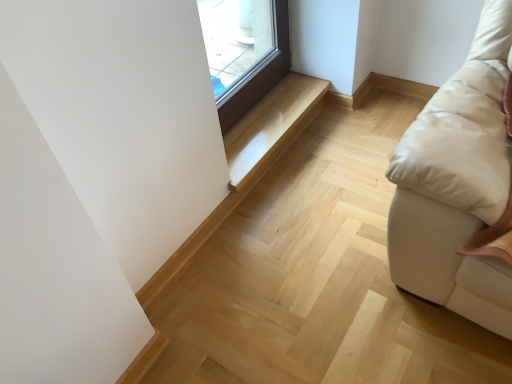
What is the approximate height of light wood stairwell at center, placed as the second stairwell when sorted from top to bottom?

9.00 centimeters.

In order to click on light wood stairwell at center, marked as the first stairwell in a bottom-to-top arrangement in this screenshot , I will do `click(249, 160)`.

Measure the distance between light wood stairwell at center, marked as the first stairwell in a bottom-to-top arrangement, and camera.

light wood stairwell at center, marked as the first stairwell in a bottom-to-top arrangement, is 5.05 feet from camera.

The width and height of the screenshot is (512, 384). What do you see at coordinates (249, 160) in the screenshot? I see `light wood stairwell at center, marked as the first stairwell in a bottom-to-top arrangement` at bounding box center [249, 160].

What do you see at coordinates (269, 125) in the screenshot? I see `glossy wood bench at center, arranged as the 1th stairwell when viewed from the top` at bounding box center [269, 125].

Identify the location of glossy wood bench at center, arranged as the 1th stairwell when viewed from the top. Image resolution: width=512 pixels, height=384 pixels. (269, 125).

How much space does glossy wood bench at center, which appears as the second stairwell when ordered from the bottom, occupy horizontally?

The width of glossy wood bench at center, which appears as the second stairwell when ordered from the bottom, is 12.02 inches.

Locate an element on the screen. light wood stairwell at center, marked as the first stairwell in a bottom-to-top arrangement is located at coordinates (249, 160).

Which object is positioned more to the left, light wood stairwell at center, marked as the first stairwell in a bottom-to-top arrangement, or glossy wood bench at center, which appears as the second stairwell when ordered from the bottom?

From the viewer's perspective, light wood stairwell at center, marked as the first stairwell in a bottom-to-top arrangement, appears more on the left side.

Considering the relative positions of light wood stairwell at center, marked as the first stairwell in a bottom-to-top arrangement, and glossy wood bench at center, arranged as the 1th stairwell when viewed from the top, in the image provided, is light wood stairwell at center, marked as the first stairwell in a bottom-to-top arrangement, behind glossy wood bench at center, arranged as the 1th stairwell when viewed from the top,?

No, it is in front of glossy wood bench at center, arranged as the 1th stairwell when viewed from the top.

Which is nearer, [291,102] or [290,111]?

Positioned in front is point [290,111].

From the image's perspective, does light wood stairwell at center, marked as the first stairwell in a bottom-to-top arrangement, appear higher than glossy wood bench at center, arranged as the 1th stairwell when viewed from the top?

Actually, light wood stairwell at center, marked as the first stairwell in a bottom-to-top arrangement, appears below glossy wood bench at center, arranged as the 1th stairwell when viewed from the top, in the image.

From a real-world perspective, is light wood stairwell at center, marked as the first stairwell in a bottom-to-top arrangement, above or below glossy wood bench at center, arranged as the 1th stairwell when viewed from the top?

In terms of real-world spatial position, light wood stairwell at center, marked as the first stairwell in a bottom-to-top arrangement, is below glossy wood bench at center, arranged as the 1th stairwell when viewed from the top.

Which of these two, light wood stairwell at center, placed as the second stairwell when sorted from top to bottom, or glossy wood bench at center, which appears as the second stairwell when ordered from the bottom, is thinner?

light wood stairwell at center, placed as the second stairwell when sorted from top to bottom.

Consider the image. Who is taller, light wood stairwell at center, placed as the second stairwell when sorted from top to bottom, or glossy wood bench at center, which appears as the second stairwell when ordered from the bottom?

light wood stairwell at center, placed as the second stairwell when sorted from top to bottom.

Considering the relative sizes of light wood stairwell at center, marked as the first stairwell in a bottom-to-top arrangement, and glossy wood bench at center, arranged as the 1th stairwell when viewed from the top, in the image provided, is light wood stairwell at center, marked as the first stairwell in a bottom-to-top arrangement, smaller than glossy wood bench at center, arranged as the 1th stairwell when viewed from the top,?

Yes.

Is glossy wood bench at center, arranged as the 1th stairwell when viewed from the top, a part of light wood stairwell at center, marked as the first stairwell in a bottom-to-top arrangement?

That's incorrect, glossy wood bench at center, arranged as the 1th stairwell when viewed from the top, is not inside light wood stairwell at center, marked as the first stairwell in a bottom-to-top arrangement.

Are light wood stairwell at center, placed as the second stairwell when sorted from top to bottom, and glossy wood bench at center, which appears as the second stairwell when ordered from the bottom, beside each other?

Yes, light wood stairwell at center, placed as the second stairwell when sorted from top to bottom, is beside glossy wood bench at center, which appears as the second stairwell when ordered from the bottom.

Is light wood stairwell at center, placed as the second stairwell when sorted from top to bottom, aimed at glossy wood bench at center, arranged as the 1th stairwell when viewed from the top?

No, light wood stairwell at center, placed as the second stairwell when sorted from top to bottom, is not oriented towards glossy wood bench at center, arranged as the 1th stairwell when viewed from the top.

Can you tell me how much light wood stairwell at center, marked as the first stairwell in a bottom-to-top arrangement, and glossy wood bench at center, which appears as the second stairwell when ordered from the bottom, differ in facing direction?

There is a 0.0437-degree angle between the facing directions of light wood stairwell at center, marked as the first stairwell in a bottom-to-top arrangement, and glossy wood bench at center, which appears as the second stairwell when ordered from the bottom.

Measure the distance from light wood stairwell at center, placed as the second stairwell when sorted from top to bottom, to glossy wood bench at center, arranged as the 1th stairwell when viewed from the top.

The distance of light wood stairwell at center, placed as the second stairwell when sorted from top to bottom, from glossy wood bench at center, arranged as the 1th stairwell when viewed from the top, is 1.53 inches.

In the image, there is a glossy wood bench at center, which appears as the second stairwell when ordered from the bottom. At what (x,y) coordinates should I click in order to perform the action: click on stairwell below it (from a real-world perspective). Please return your answer as a coordinate pair (x, y). This screenshot has height=384, width=512. Looking at the image, I should click on (249, 160).

Visually, is glossy wood bench at center, which appears as the second stairwell when ordered from the bottom, positioned to the left or to the right of light wood stairwell at center, placed as the second stairwell when sorted from top to bottom?

glossy wood bench at center, which appears as the second stairwell when ordered from the bottom, is positioned on light wood stairwell at center, placed as the second stairwell when sorted from top to bottom,'s right side.

Does glossy wood bench at center, arranged as the 1th stairwell when viewed from the top, lie in front of light wood stairwell at center, marked as the first stairwell in a bottom-to-top arrangement?

No, it is not.

Is point (303, 75) positioned before point (285, 125)?

No, (303, 75) is further to viewer.

From the image's perspective, between glossy wood bench at center, arranged as the 1th stairwell when viewed from the top, and light wood stairwell at center, placed as the second stairwell when sorted from top to bottom, who is located below?

light wood stairwell at center, placed as the second stairwell when sorted from top to bottom, from the image's perspective.

Looking at this image, from a real-world perspective, which object stands above the other?

In real-world perspective, glossy wood bench at center, which appears as the second stairwell when ordered from the bottom, is above.

Can you confirm if glossy wood bench at center, which appears as the second stairwell when ordered from the bottom, is wider than light wood stairwell at center, marked as the first stairwell in a bottom-to-top arrangement?

Correct, the width of glossy wood bench at center, which appears as the second stairwell when ordered from the bottom, exceeds that of light wood stairwell at center, marked as the first stairwell in a bottom-to-top arrangement.

Who is taller, glossy wood bench at center, which appears as the second stairwell when ordered from the bottom, or light wood stairwell at center, marked as the first stairwell in a bottom-to-top arrangement?

light wood stairwell at center, marked as the first stairwell in a bottom-to-top arrangement, is taller.

Is glossy wood bench at center, arranged as the 1th stairwell when viewed from the top, bigger than light wood stairwell at center, placed as the second stairwell when sorted from top to bottom?

Yes, glossy wood bench at center, arranged as the 1th stairwell when viewed from the top, is bigger than light wood stairwell at center, placed as the second stairwell when sorted from top to bottom.

Is glossy wood bench at center, which appears as the second stairwell when ordered from the bottom, positioned beyond the bounds of light wood stairwell at center, marked as the first stairwell in a bottom-to-top arrangement?

Yes, glossy wood bench at center, which appears as the second stairwell when ordered from the bottom, is outside of light wood stairwell at center, marked as the first stairwell in a bottom-to-top arrangement.

Is glossy wood bench at center, which appears as the second stairwell when ordered from the bottom, placed right next to light wood stairwell at center, marked as the first stairwell in a bottom-to-top arrangement?

Yes, glossy wood bench at center, which appears as the second stairwell when ordered from the bottom, and light wood stairwell at center, marked as the first stairwell in a bottom-to-top arrangement, clearly make contact.

Could you tell me if glossy wood bench at center, arranged as the 1th stairwell when viewed from the top, is turned towards light wood stairwell at center, placed as the second stairwell when sorted from top to bottom?

No, glossy wood bench at center, arranged as the 1th stairwell when viewed from the top, is not oriented towards light wood stairwell at center, placed as the second stairwell when sorted from top to bottom.

Could you measure the distance between glossy wood bench at center, which appears as the second stairwell when ordered from the bottom, and light wood stairwell at center, marked as the first stairwell in a bottom-to-top arrangement?

The distance of glossy wood bench at center, which appears as the second stairwell when ordered from the bottom, from light wood stairwell at center, marked as the first stairwell in a bottom-to-top arrangement, is 1.53 inches.

At what (x,y) coordinates should I click in order to perform the action: click on stairwell in front of the glossy wood bench at center, arranged as the 1th stairwell when viewed from the top. Please return your answer as a coordinate pair (x, y). The width and height of the screenshot is (512, 384). Looking at the image, I should click on (249, 160).

I want to click on stairwell above the light wood stairwell at center, placed as the second stairwell when sorted from top to bottom (from a real-world perspective), so click(x=269, y=125).

What are the coordinates of `stairwell located below the glossy wood bench at center, arranged as the 1th stairwell when viewed from the top (from the image's perspective)` in the screenshot? It's located at (249, 160).